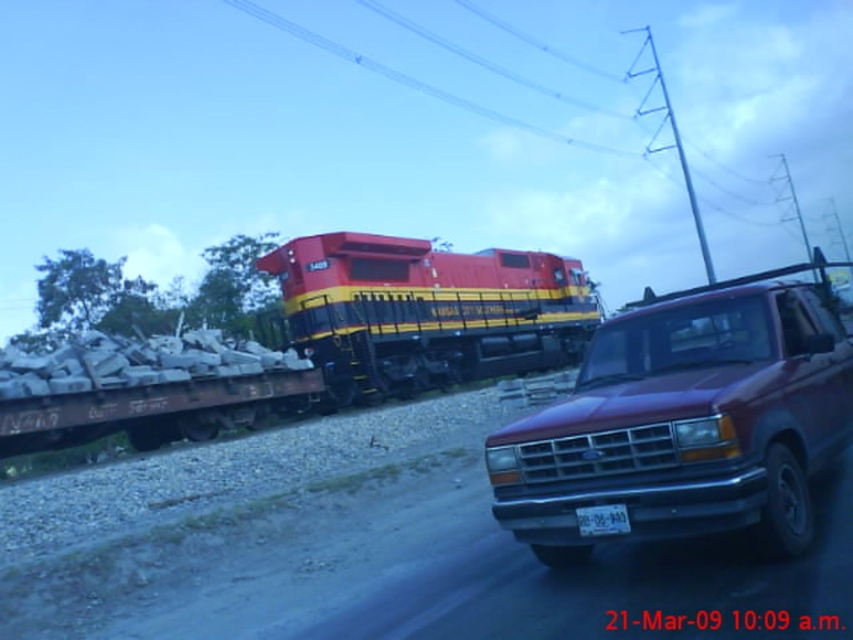
You are a delivery driver trying to park your truck in a tight space. You see a maroon metallic truck at right and a matte black truck at center. Which truck would require more space to park?

The matte black truck at center requires more space to park because it occupies more space than the maroon metallic truck at right.

You are a delivery driver who needs to park your truck in a loading zone that has a height restriction of 12 feet. You see the maroon metallic truck at right and the matte black truck at center. Which truck is more likely to comply with the height restriction?

The maroon metallic truck at right has a lesser height compared to the matte black truck at center, so it is more likely to comply with the height restriction of 12 feet.